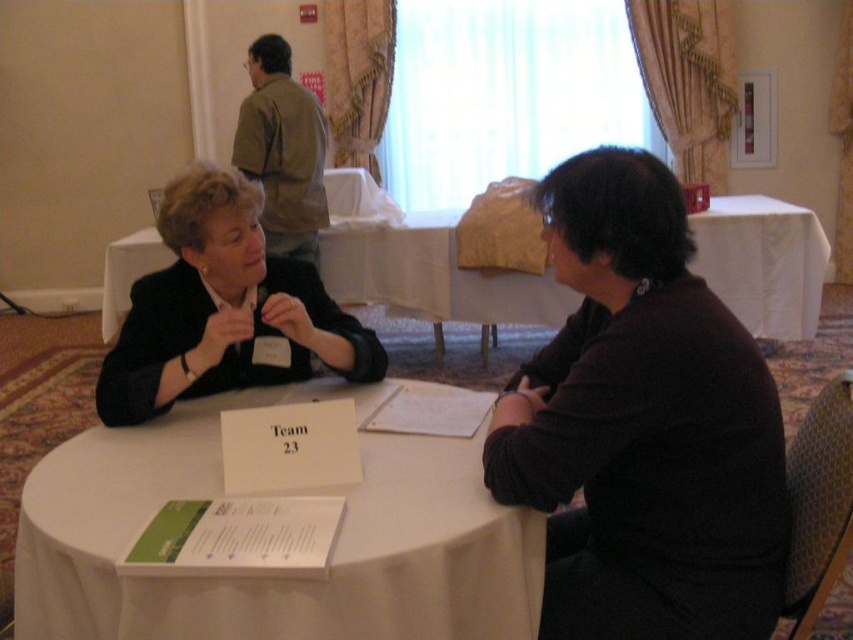
Which is above, black matte jacket at center or white cloth at center?

white cloth at center is above.

Image resolution: width=853 pixels, height=640 pixels. Find the location of `black matte jacket at center`. black matte jacket at center is located at coordinates (224, 308).

At what (x,y) coordinates should I click in order to perform the action: click on black matte jacket at center. Please return your answer as a coordinate pair (x, y). Image resolution: width=853 pixels, height=640 pixels. Looking at the image, I should click on (224, 308).

Can you confirm if white cloth-covered table at center is positioned to the left of black matte jacket at center?

In fact, white cloth-covered table at center is to the right of black matte jacket at center.

Can you confirm if white cloth-covered table at center is shorter than black matte jacket at center?

Indeed, white cloth-covered table at center has a lesser height compared to black matte jacket at center.

Is point (350, 508) closer to camera compared to point (216, 262)?

Yes, it is.

Locate an element on the screen. The width and height of the screenshot is (853, 640). white cloth-covered table at center is located at coordinates (276, 579).

Image resolution: width=853 pixels, height=640 pixels. What are the coordinates of `white cloth-covered table at center` in the screenshot? It's located at (276, 579).

Does point (405, 472) come in front of point (451, 300)?

Yes, point (405, 472) is closer to viewer.

Which is in front, point (138, 435) or point (444, 230)?

Point (138, 435) is in front.

Identify the location of white cloth-covered table at center. The height and width of the screenshot is (640, 853). (276, 579).